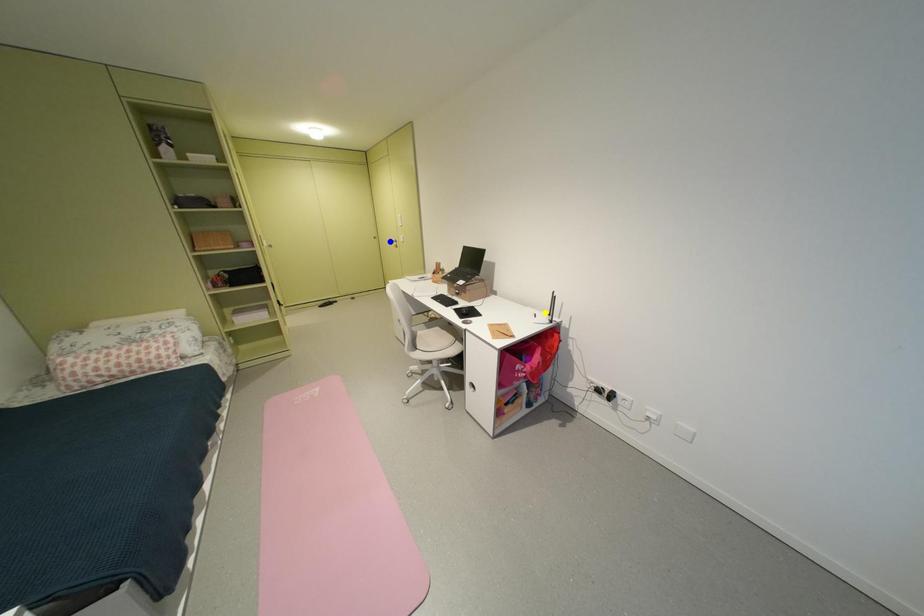
Order these from farthest to nearest:
purple point | blue point | yellow point

blue point
yellow point
purple point